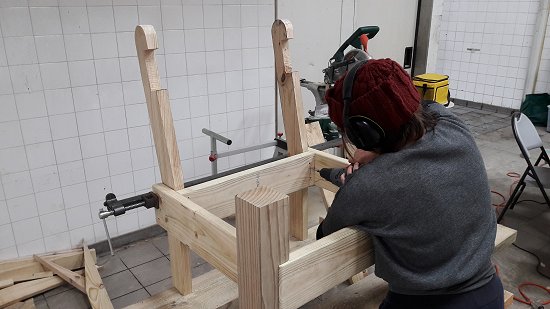
Where is `chair`? chair is located at coordinates [526, 123].